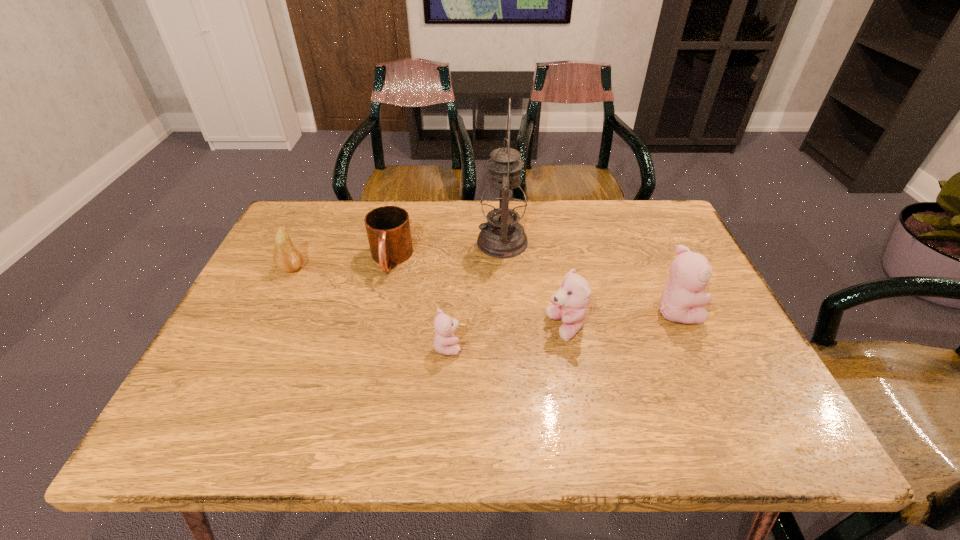
The width and height of the screenshot is (960, 540). Find the location of `vacant space located at the face of the second tallest teddy bear`. vacant space located at the face of the second tallest teddy bear is located at coordinates (433, 328).

Find the location of a particular element. vacant space located at the face of the second tallest teddy bear is located at coordinates (386, 328).

The height and width of the screenshot is (540, 960). Identify the location of vacant space situated at the face of the second tallest teddy bear. (486, 328).

Find the location of `free space located 0.060m at the face of the rightmost object`. free space located 0.060m at the face of the rightmost object is located at coordinates (723, 310).

Locate an element on the screen. The height and width of the screenshot is (540, 960). vacant region located 0.350m on the front of the oil lamp is located at coordinates (510, 367).

Identify the location of free location located 0.120m on the back of the pear. (309, 233).

The image size is (960, 540). I want to click on vacant space situated 0.310m on the side of the fifth object from right to left with the handle, so click(362, 383).

Where is `oil lamp positioned at the far edge`? oil lamp positioned at the far edge is located at coordinates (503, 205).

Find the location of a particular element. mug present at the far edge is located at coordinates (388, 229).

Where is `object situated at the left edge`? object situated at the left edge is located at coordinates (287, 257).